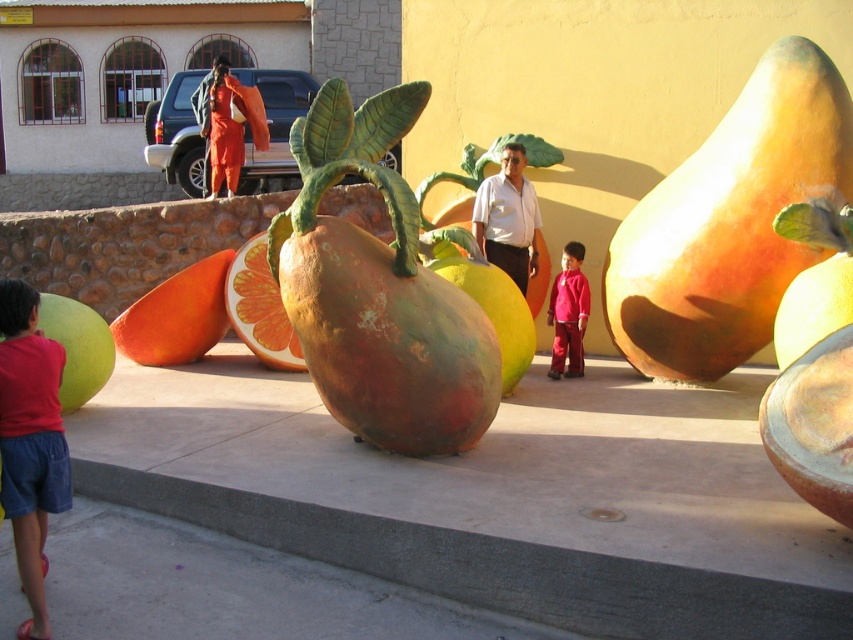
Question: Among these points, which one is nearest to the camera?

Choices:
 (A) (39, 323)
 (B) (837, 257)
 (C) (257, 236)

Answer: (B)

Question: Can you confirm if orange matte grapefruit at center is positioned to the right of rustic wood orange at center?

Choices:
 (A) yes
 (B) no

Answer: (B)

Question: Which point is farther from the camera taking this photo?

Choices:
 (A) (500, 243)
 (B) (9, 467)
 (C) (846, 256)
 (D) (451, 445)

Answer: (A)

Question: Is orange matte at center below rustic wood orange at center?

Choices:
 (A) yes
 (B) no

Answer: (A)

Question: Is orange matte at center thinner than rustic wood orange at center?

Choices:
 (A) no
 (B) yes

Answer: (A)

Question: Which object is closer to the camera taking this photo?

Choices:
 (A) red fleece jacket at center
 (B) rustic wood fruit at center
 (C) smooth orange at center
 (D) green matte apple at lower left

Answer: (B)